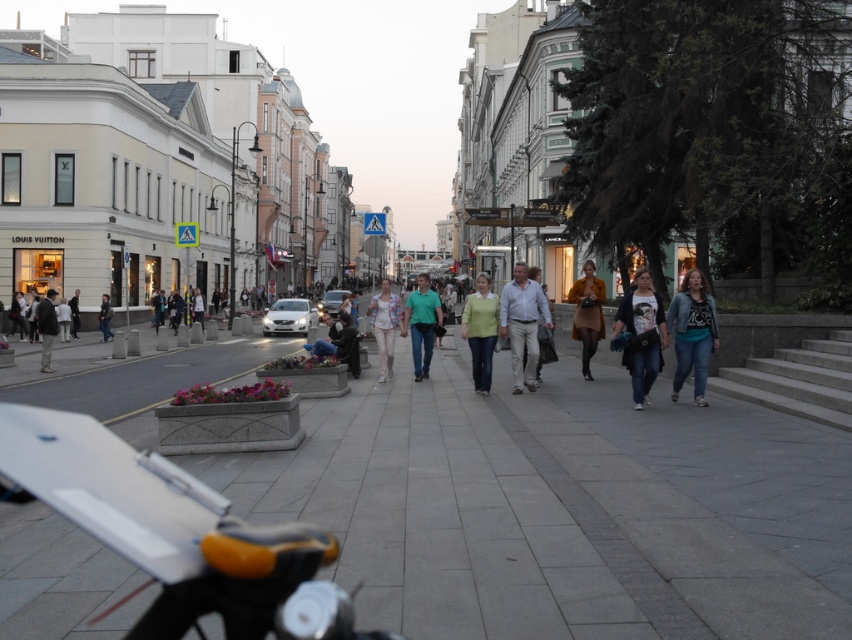
You are standing at the center of the street and want to find the light green sweater at center. In which direction should you look to locate it?

The light green sweater at center is located at the center of the scene, so you should look straight ahead to find it.